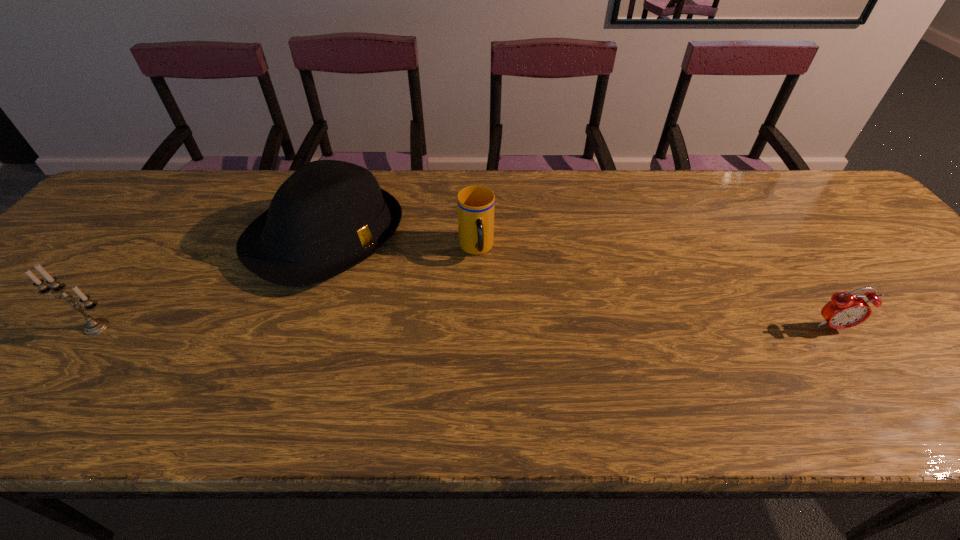
The width and height of the screenshot is (960, 540). I want to click on candle, so click(x=94, y=326).

Where is `the rightmost object`? Image resolution: width=960 pixels, height=540 pixels. the rightmost object is located at coordinates (845, 310).

The height and width of the screenshot is (540, 960). Identify the location of alarm clock. (845, 310).

Identify the location of the third tallest object. The image size is (960, 540). (475, 204).

The image size is (960, 540). What are the coordinates of `cup` in the screenshot? It's located at (475, 204).

You are a GUI agent. You are given a task and a screenshot of the screen. Output one action in this format:
    pyautogui.click(x=<x>, y=<y>)
    Task: Click on the third object from right to left
    
    Given the screenshot: What is the action you would take?
    tap(328, 216)

This screenshot has height=540, width=960. Identify the location of free space located on the back of the candle. 177,221.

You are a GUI agent. You are given a task and a screenshot of the screen. Output one action in this format:
    pyautogui.click(x=<x>, y=<y>)
    Task: Click on the free space located 0.070m on the face of the alarm clock
    This screenshot has width=960, height=540.
    Given the screenshot: What is the action you would take?
    pyautogui.click(x=856, y=361)

The image size is (960, 540). Identify the location of vacant space located on the side of the third tallest object with the handle. (498, 353).

Find the location of `free space located 0.290m on the side of the third tallest object with the handle`. free space located 0.290m on the side of the third tallest object with the handle is located at coordinates (501, 365).